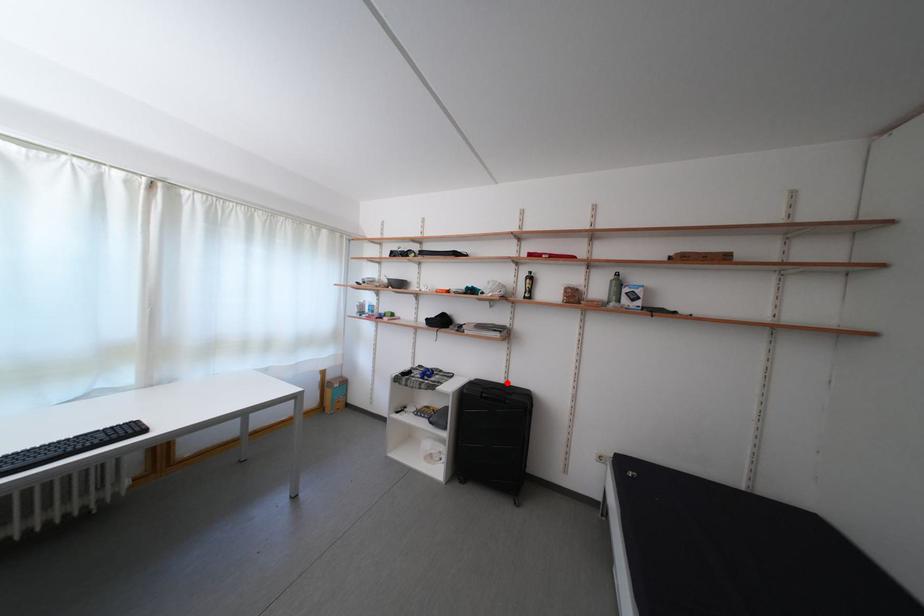
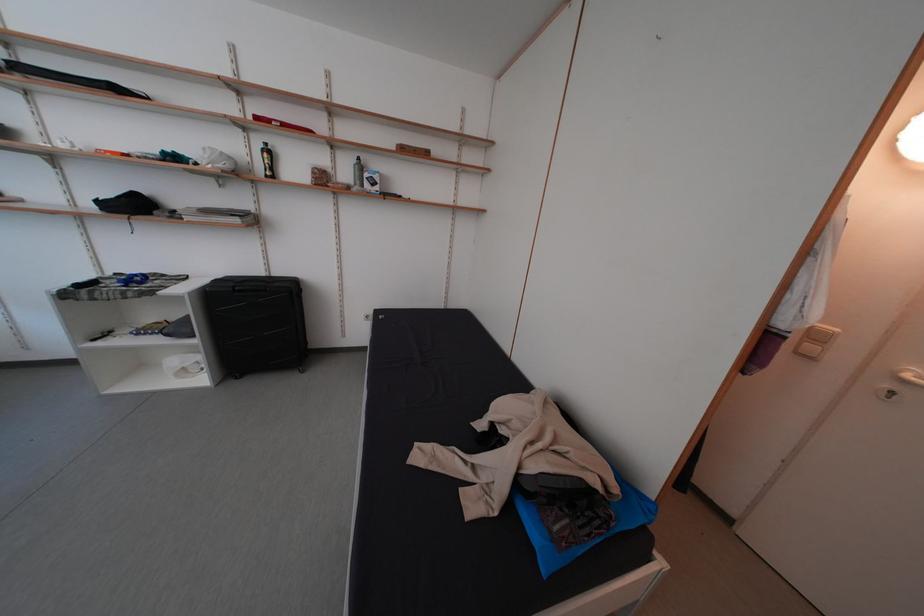
The point at the highlighted location is marked in the first image. Where is the corresponding point in the second image?

(265, 276)